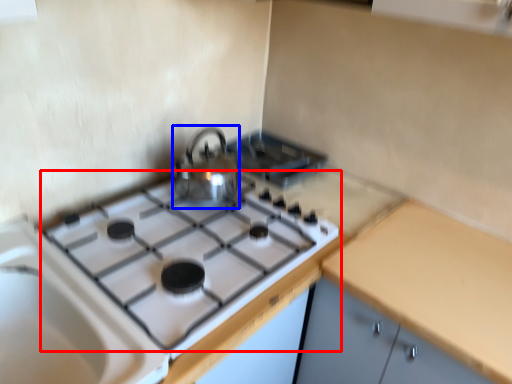
Question: Which point is closer to the camera, gas stove (highlighted by a red box) or kitchen appliance (highlighted by a blue box)?

Choices:
 (A) gas stove
 (B) kitchen appliance

Answer: (A)